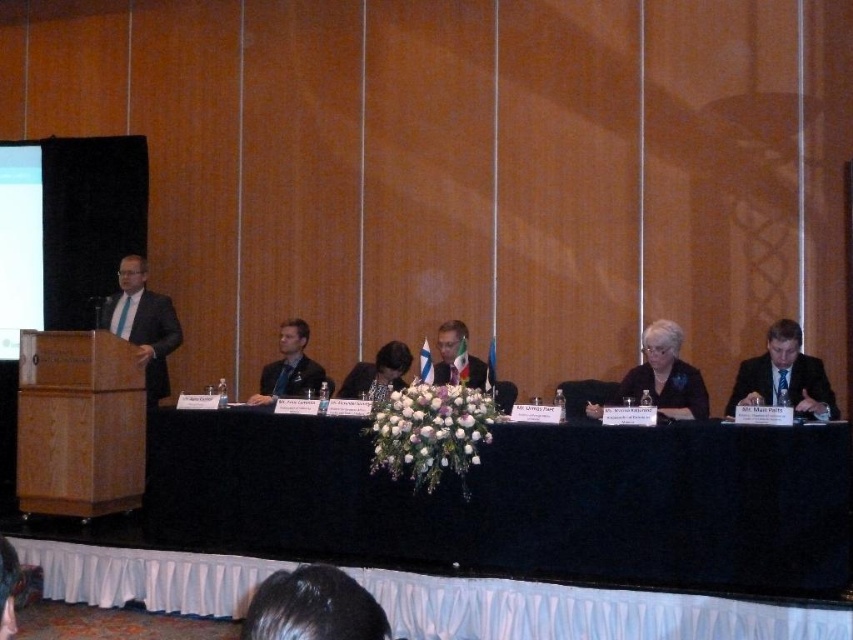
You are standing in the conference room facing the long table. There is a point marked at coordinates point (795, 403). Can you reach this point without moving your position?

The point (795, 403) is 4.79 meters away from viewer, so no, you cannot reach it without moving since it is too far away.

You are a photographer setting up for a conference photo. You need to ensure that the dark brown suit at center is visible above the black fabric table at center. Based on the scene, is this possible?

The black fabric table at center has a greater height compared to the dark brown suit at center, so the dark brown suit at center is shorter and may not be visible above the table unless adjusted.